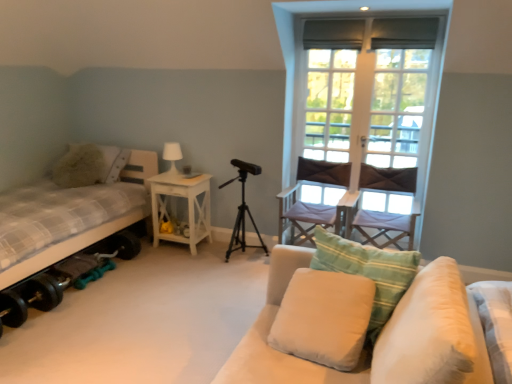
You are a GUI agent. You are given a task and a screenshot of the screen. Output one action in this format:
    pyautogui.click(x=<x>, y=<y>)
    Task: Click on the blank space situated above white matte table lamp at upper center (from a real-world perspective)
    
    Given the screenshot: What is the action you would take?
    pyautogui.click(x=172, y=145)